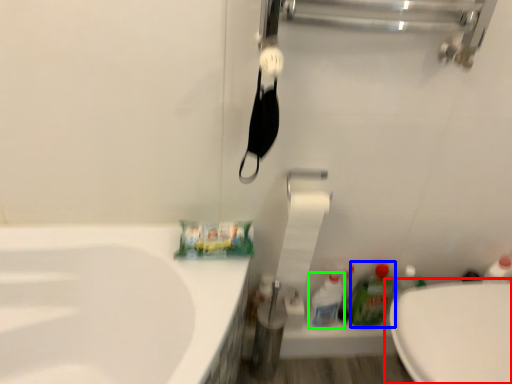
Question: Considering the real-world distances, which object is farthest from toilet (highlighted by a red box)? cleaning product (highlighted by a blue box) or cleaning product (highlighted by a green box)?

Choices:
 (A) cleaning product
 (B) cleaning product

Answer: (B)